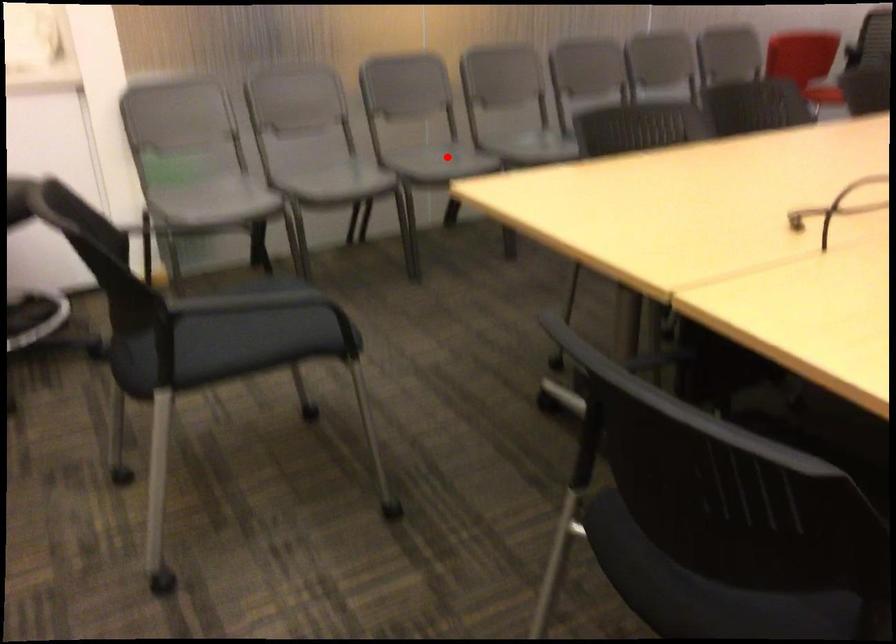
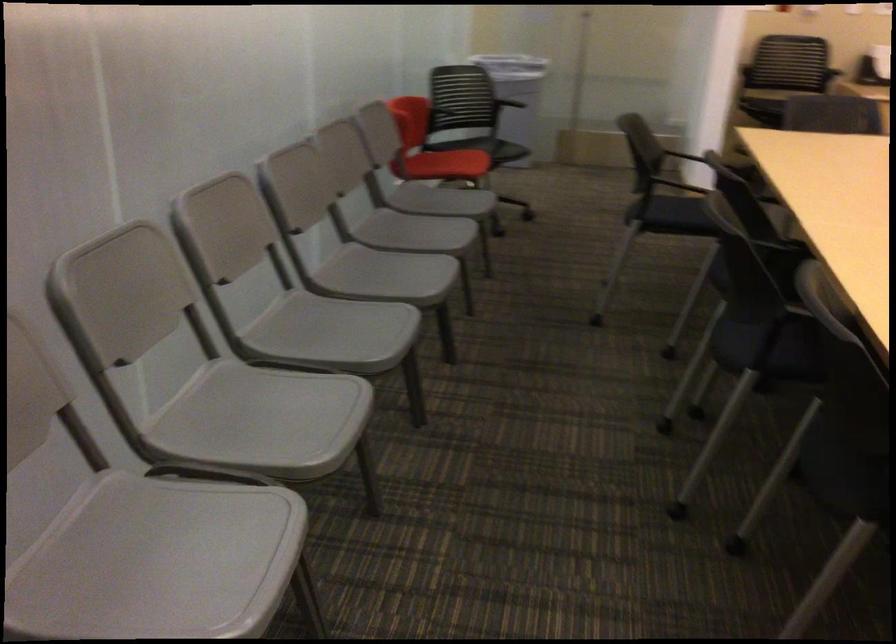
Where in the second image is the point corresponding to the highlighted location from the first image?

(263, 420)